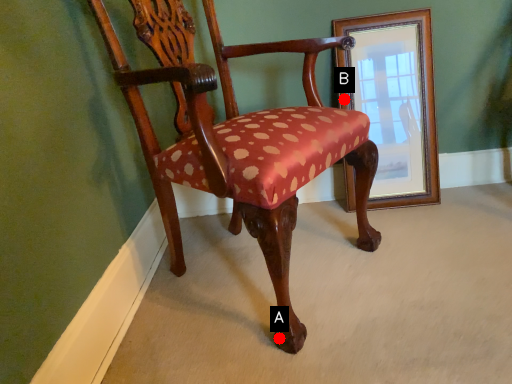
Question: Two points are circled on the image, labeled by A and B beside each circle. Which point is closer to the camera?

Choices:
 (A) A is closer
 (B) B is closer

Answer: (A)